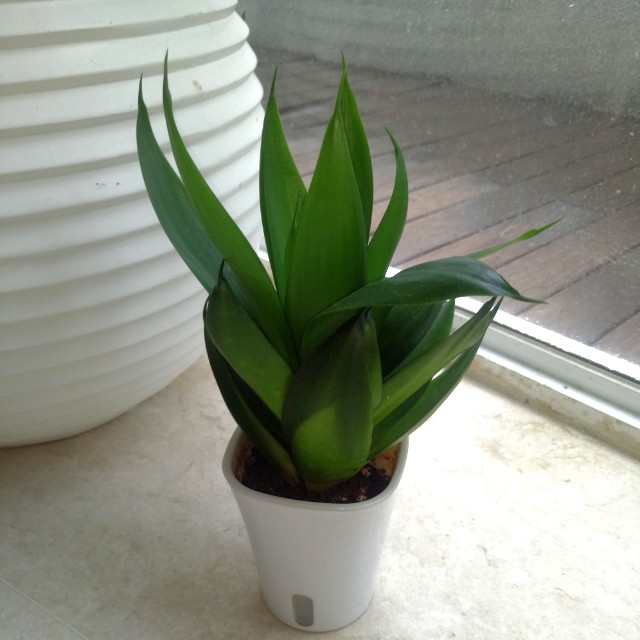
Locate an element on the screen. Image resolution: width=640 pixels, height=640 pixels. white trim is located at coordinates (575, 374).